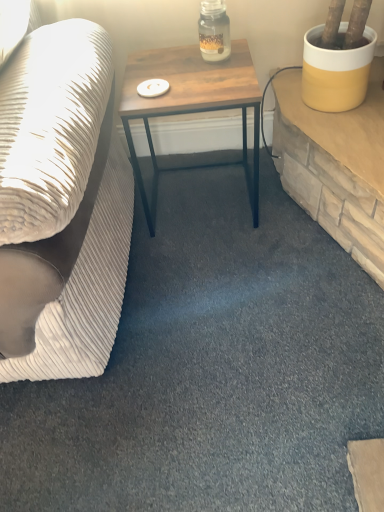
You are a GUI agent. You are given a task and a screenshot of the screen. Output one action in this format:
    pyautogui.click(x=<x>, y=<y>)
    Task: Click on the wooden table at center
    
    Given the screenshot: What is the action you would take?
    pyautogui.click(x=191, y=104)

From the image's perspective, is white textured fabric couch at left over wooden table at center?

Correct, white textured fabric couch at left appears higher than wooden table at center in the image.

Considering the relative sizes of white textured fabric couch at left and wooden table at center in the image provided, is white textured fabric couch at left taller than wooden table at center?

Yes.

Locate an element on the screen. The height and width of the screenshot is (512, 384). table below the white textured fabric couch at left (from the image's perspective) is located at coordinates (191, 104).

Do you think translucent glass jar at center is within wooden table at center, or outside of it?

translucent glass jar at center exists outside the volume of wooden table at center.

Considering the points (213, 2) and (189, 92), which point is in front, point (213, 2) or point (189, 92)?

The point (189, 92) is more forward.

Considering the relative sizes of translucent glass jar at center and wooden table at center in the image provided, is translucent glass jar at center shorter than wooden table at center?

Indeed, translucent glass jar at center has a lesser height compared to wooden table at center.

Considering the positions of objects translucent glass jar at center and wooden table at center in the image provided, who is behind, translucent glass jar at center or wooden table at center?

translucent glass jar at center is further from the camera.

Which object is positioned more to the right, white textured fabric couch at left or translucent glass jar at center?

translucent glass jar at center is more to the right.

How different are the orientations of white textured fabric couch at left and translucent glass jar at center in degrees?

87.7 degrees.

Locate an element on the screen. This screenshot has width=384, height=512. studio couch in front of the translucent glass jar at center is located at coordinates 61,205.

Could you tell me if white textured fabric couch at left is facing translucent glass jar at center?

No, white textured fabric couch at left is not facing towards translucent glass jar at center.

Is translucent glass jar at center looking in the opposite direction of white textured fabric couch at left?

translucent glass jar at center is not turned away from white textured fabric couch at left.

Is translucent glass jar at center not inside white textured fabric couch at left?

Yes, translucent glass jar at center is outside of white textured fabric couch at left.

From the image's perspective, is translucent glass jar at center located above or below white textured fabric couch at left?

Clearly, from the image's perspective, translucent glass jar at center is above white textured fabric couch at left.

From a real-world perspective, is wooden table at center above or below translucent glass jar at center?

wooden table at center is situated lower than translucent glass jar at center in the real world.

Does wooden table at center turn towards translucent glass jar at center?

No, wooden table at center is not oriented towards translucent glass jar at center.

Identify the location of bottle on the right of wooden table at center. The image size is (384, 512). (214, 31).

Would you say wooden table at center is outside white textured fabric couch at left?

Yes, wooden table at center is outside of white textured fabric couch at left.

Is wooden table at center bigger or smaller than white textured fabric couch at left?

In the image, wooden table at center appears to be smaller than white textured fabric couch at left.

Where is `table behind the white textured fabric couch at left`? This screenshot has height=512, width=384. table behind the white textured fabric couch at left is located at coordinates (191, 104).

Who is shorter, wooden table at center or white textured fabric couch at left?

wooden table at center.

The image size is (384, 512). Identify the location of studio couch above the wooden table at center (from the image's perspective). (61, 205).

Find the location of `bottle to the right of wooden table at center`. bottle to the right of wooden table at center is located at coordinates (214, 31).

Considering their positions, is wooden table at center positioned further to white textured fabric couch at left than translucent glass jar at center?

translucent glass jar at center lies further to white textured fabric couch at left than the other object.

Based on their spatial positions, is translucent glass jar at center or white textured fabric couch at left closer to wooden table at center?

The object closer to wooden table at center is translucent glass jar at center.

Based on their spatial positions, is white textured fabric couch at left or wooden table at center further from translucent glass jar at center?

Among the two, white textured fabric couch at left is located further to translucent glass jar at center.

Which object lies nearer to the anchor point white textured fabric couch at left, translucent glass jar at center or wooden table at center?

wooden table at center lies closer to white textured fabric couch at left than the other object.

In the scene shown: When comparing their distances from translucent glass jar at center, does wooden table at center or white textured fabric couch at left seem further?

Among the two, white textured fabric couch at left is located further to translucent glass jar at center.

Looking at the image, which one is located closer to wooden table at center, white textured fabric couch at left or translucent glass jar at center?

The object closer to wooden table at center is translucent glass jar at center.

I want to click on table situated between white textured fabric couch at left and translucent glass jar at center from left to right, so click(x=191, y=104).